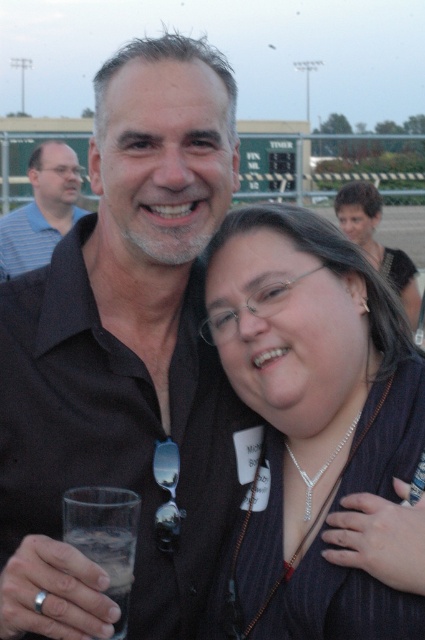
Does point (365, 202) come farther from viewer compared to point (317, 476)?

Yes, point (365, 202) is behind point (317, 476).

Does matte black hair at upper right appear over silver metallic necklace at center?

Yes.

Between point (414, 326) and point (289, 451), which one is positioned behind?

The point (414, 326) is behind.

You are a GUI agent. You are given a task and a screenshot of the screen. Output one action in this format:
    pyautogui.click(x=<x>, y=<y>)
    Task: Click on the matte black hair at upper right
    
    Given the screenshot: What is the action you would take?
    pyautogui.click(x=376, y=241)

Does pinstriped fabric dress at center appear under matte black hair at upper right?

Yes.

Which is more to the left, pinstriped fabric dress at center or matte black hair at upper right?

Positioned to the left is pinstriped fabric dress at center.

Is point (342, 499) closer to viewer compared to point (367, 195)?

Yes.

At what (x,y) coordinates should I click in order to perform the action: click on pinstriped fabric dress at center. Please return your answer as a coordinate pair (x, y). This screenshot has width=425, height=640. Looking at the image, I should click on (311, 422).

Between point (22, 346) and point (394, 259), which one is positioned in front?

Point (22, 346)

Does black shirt at center appear on the right side of matte black hair at upper right?

No, black shirt at center is not to the right of matte black hair at upper right.

The image size is (425, 640). Describe the element at coordinates (124, 355) in the screenshot. I see `black shirt at center` at that location.

Locate an element on the screen. The image size is (425, 640). black shirt at center is located at coordinates 124,355.